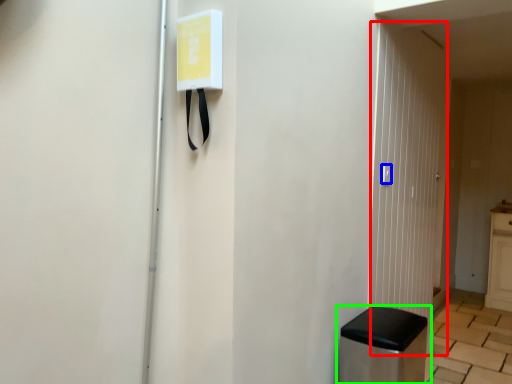
Question: Based on their relative distances, which object is farther from glass door (highlighted by a red box)? Choose from light switch (highlighted by a blue box) and furniture (highlighted by a green box).

Choices:
 (A) light switch
 (B) furniture

Answer: (B)